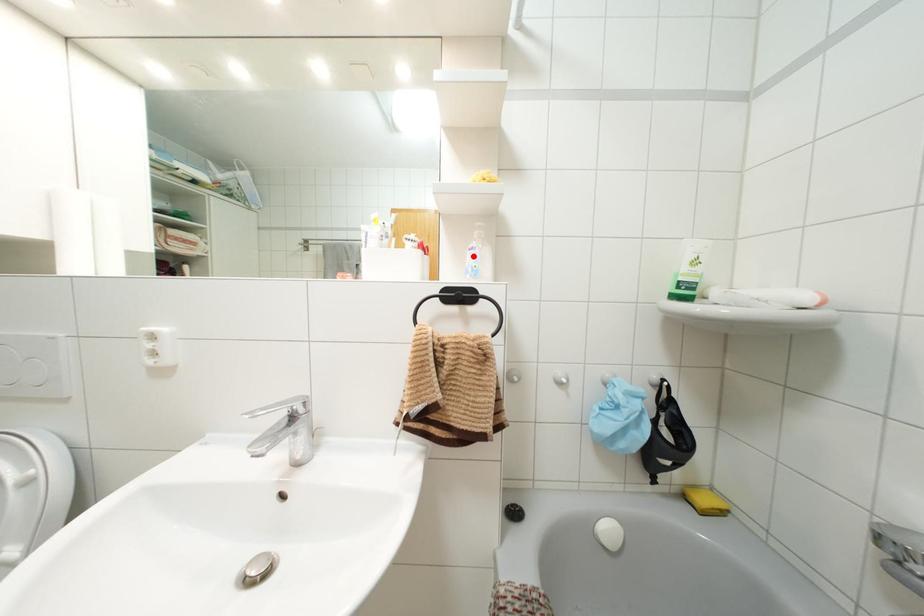
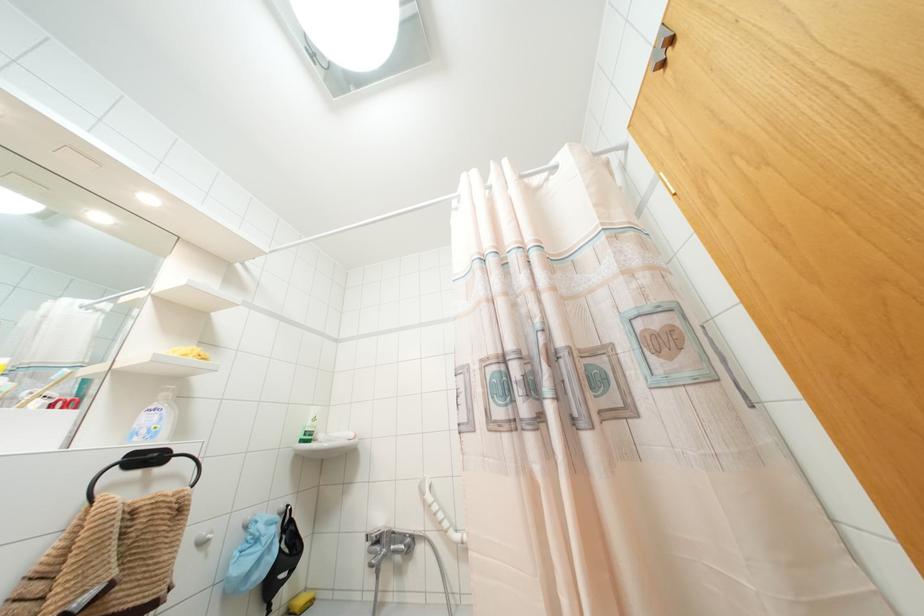
Find the pixel in the second image that matches the highlighted location in the first image.

(154, 418)